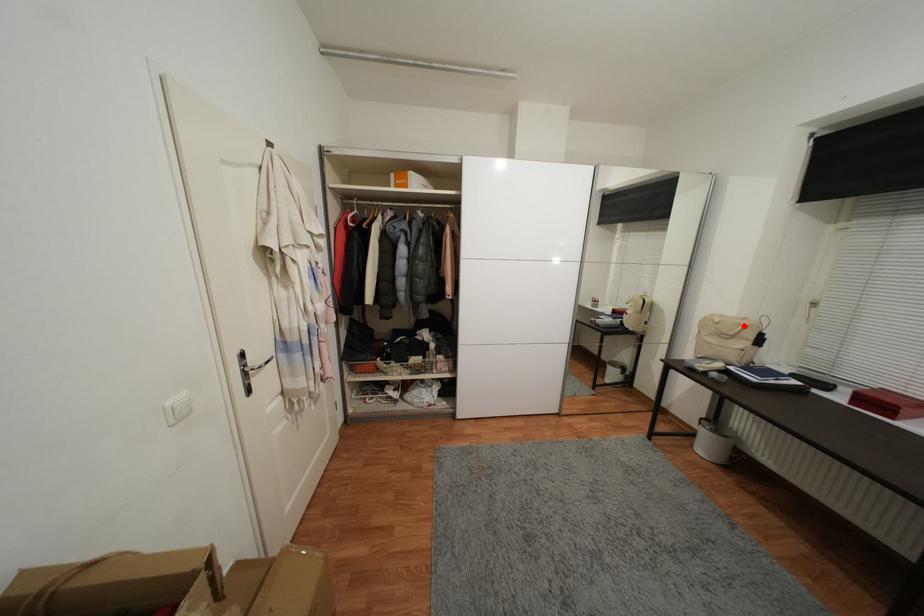
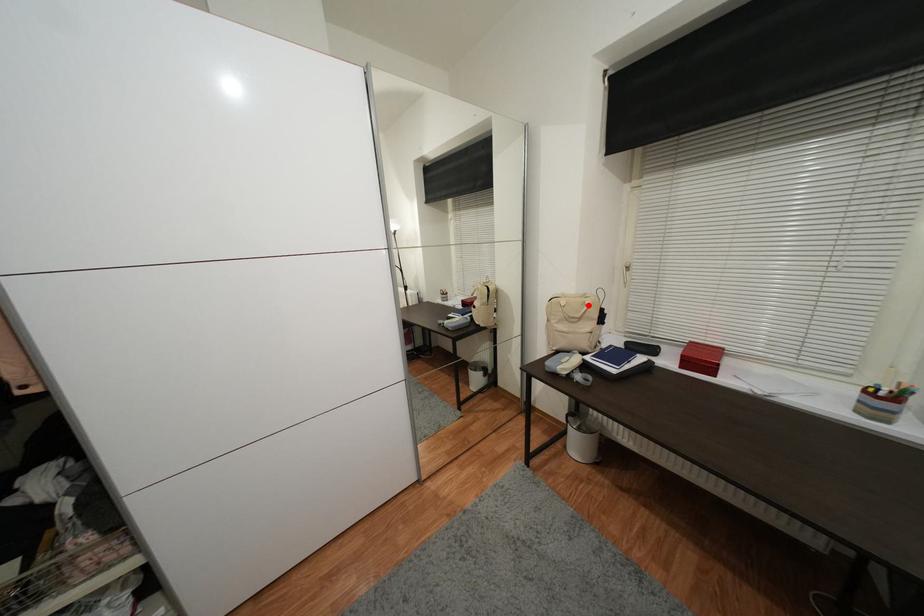
I am providing you with two images of the same scene from different viewpoints. A red point is marked on the first image and another point is marked on the second image. Does the point marked in image1 correspond to the same location as the one in image2?

Yes